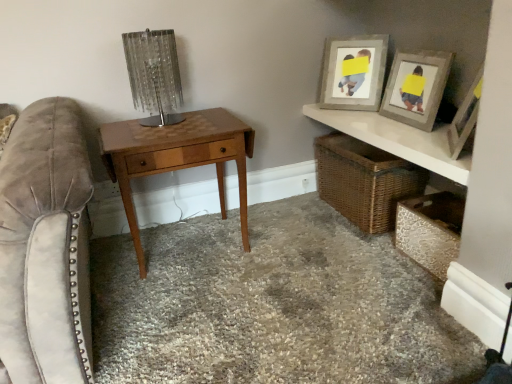
Find the location of a particular element. This screenshot has height=384, width=512. vacant area that lies to the right of clear glass table lamp at upper left is located at coordinates (212, 122).